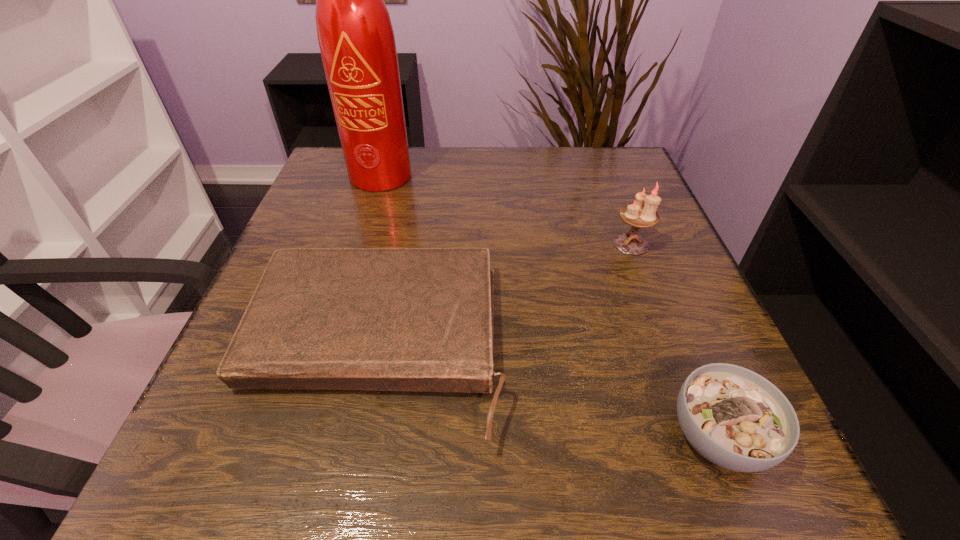
Where is `object at the far edge`? object at the far edge is located at coordinates (355, 34).

Find the location of `soup bowl that is at the near edge`. soup bowl that is at the near edge is located at coordinates (735, 418).

The image size is (960, 540). Identify the location of paperback book that is at the near edge. (384, 319).

What are the coordinates of `fire extinguisher present at the left edge` in the screenshot? It's located at (355, 34).

The height and width of the screenshot is (540, 960). I want to click on paperback book located in the left edge section of the desktop, so click(x=384, y=319).

Where is `candle holder that is positioned at the right edge`? candle holder that is positioned at the right edge is located at coordinates (637, 215).

Image resolution: width=960 pixels, height=540 pixels. What are the coordinates of `soup bowl located in the right edge section of the desktop` in the screenshot? It's located at (735, 418).

Find the location of `object positioned at the far left corner`. object positioned at the far left corner is located at coordinates (355, 34).

At what (x,y) coordinates should I click in order to perform the action: click on object present at the near left corner. Please return your answer as a coordinate pair (x, y). This screenshot has width=960, height=540. Looking at the image, I should click on (384, 319).

Find the location of a particular element. object that is at the near right corner is located at coordinates (735, 418).